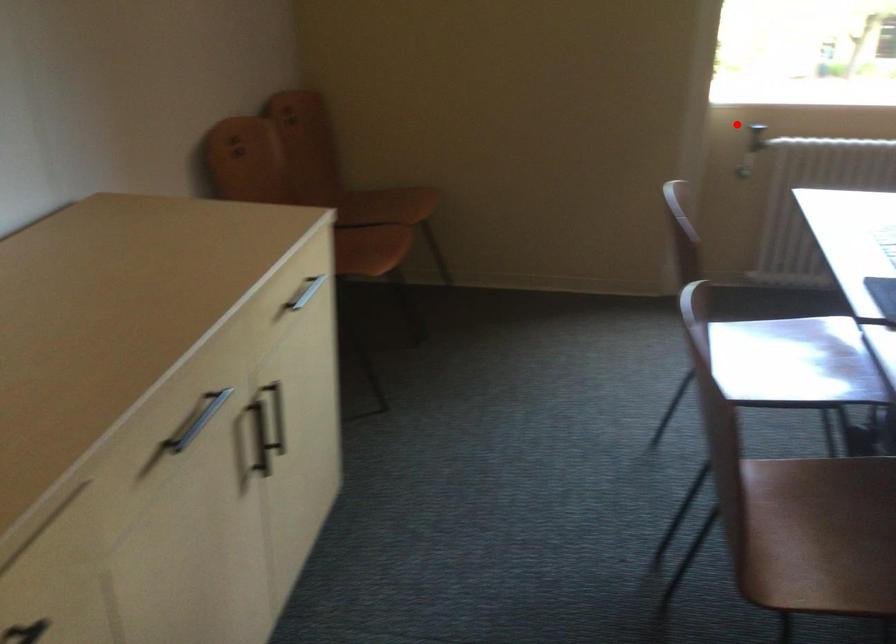
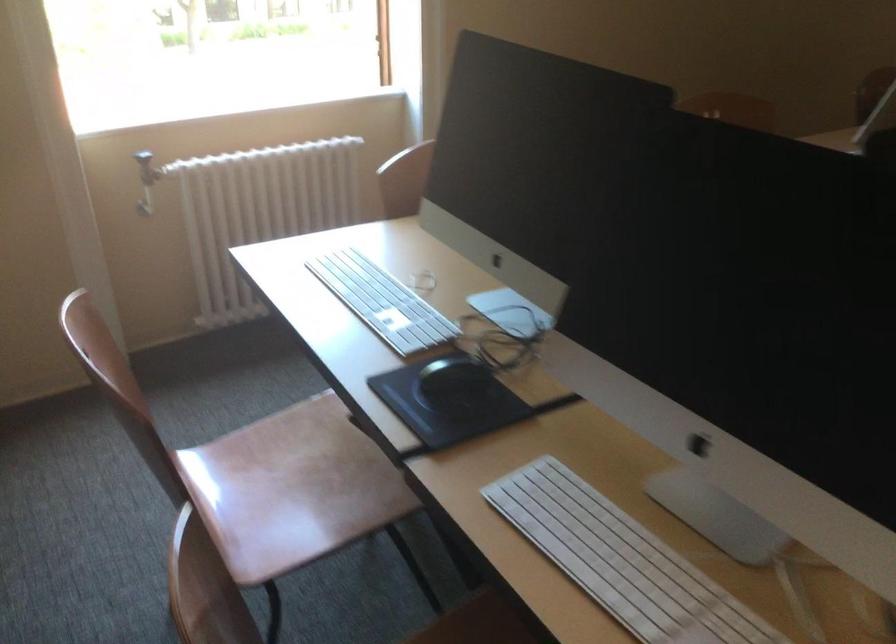
Find the pixel in the second image that matches the highlighted location in the first image.

(147, 167)